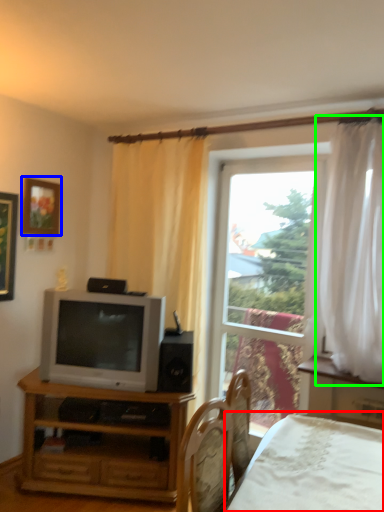
Question: Which is nearer to the bed (highlighted by a red box)? picture frame (highlighted by a blue box) or curtain (highlighted by a green box).

Choices:
 (A) picture frame
 (B) curtain

Answer: (B)